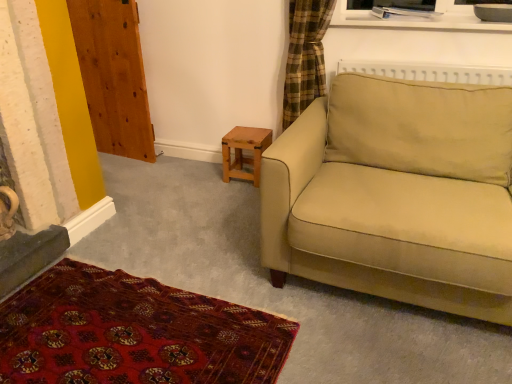
Question: From a real-world perspective, is carpet with intricate patterns at lower left positioned under beige fabric couch at right based on gravity?

Choices:
 (A) no
 (B) yes

Answer: (B)

Question: Can you confirm if carpet with intricate patterns at lower left is wider than beige fabric couch at right?

Choices:
 (A) no
 (B) yes

Answer: (B)

Question: Is carpet with intricate patterns at lower left placed right next to beige fabric couch at right?

Choices:
 (A) yes
 (B) no

Answer: (B)

Question: From the image's perspective, is carpet with intricate patterns at lower left located beneath beige fabric couch at right?

Choices:
 (A) no
 (B) yes

Answer: (B)

Question: Considering the relative sizes of carpet with intricate patterns at lower left and beige fabric couch at right in the image provided, is carpet with intricate patterns at lower left bigger than beige fabric couch at right?

Choices:
 (A) no
 (B) yes

Answer: (A)

Question: From the image's perspective, is wooden stool at lower center above or below wooden at left?

Choices:
 (A) above
 (B) below

Answer: (B)

Question: Is wooden stool at lower center in front of or behind wooden at left in the image?

Choices:
 (A) behind
 (B) front

Answer: (A)

Question: Visually, is wooden stool at lower center positioned to the left or to the right of wooden at left?

Choices:
 (A) left
 (B) right

Answer: (B)

Question: Is point (248, 158) positioned closer to the camera than point (78, 54)?

Choices:
 (A) farther
 (B) closer

Answer: (B)

Question: From a real-world perspective, is beige fabric couch at right positioned above or below carpet with intricate patterns at lower left?

Choices:
 (A) below
 (B) above

Answer: (B)

Question: In terms of width, does beige fabric couch at right look wider or thinner when compared to carpet with intricate patterns at lower left?

Choices:
 (A) wide
 (B) thin

Answer: (B)

Question: Is beige fabric couch at right to the left or to the right of carpet with intricate patterns at lower left in the image?

Choices:
 (A) left
 (B) right

Answer: (B)

Question: Is point (486, 279) closer or farther from the camera than point (135, 326)?

Choices:
 (A) closer
 (B) farther

Answer: (A)

Question: Visually, is wooden at left positioned to the left or to the right of carpet with intricate patterns at lower left?

Choices:
 (A) right
 (B) left

Answer: (B)

Question: Based on their sizes in the image, would you say wooden at left is bigger or smaller than carpet with intricate patterns at lower left?

Choices:
 (A) small
 (B) big

Answer: (B)